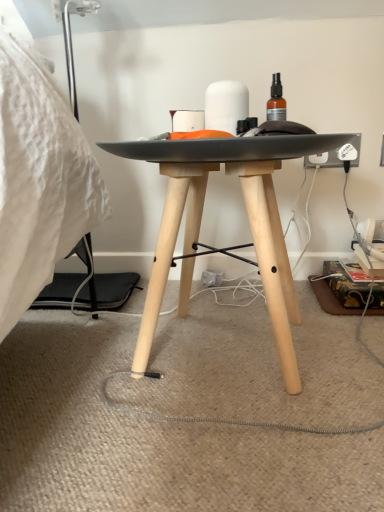
Question: Is black cord at lower center wider than white matte cylinder at center?

Choices:
 (A) yes
 (B) no

Answer: (A)

Question: From the image's perspective, is black cord at lower center beneath white matte cylinder at center?

Choices:
 (A) yes
 (B) no

Answer: (A)

Question: From the image's perspective, is black cord at lower center over white matte cylinder at center?

Choices:
 (A) yes
 (B) no

Answer: (B)

Question: Can you confirm if black cord at lower center is positioned to the right of white matte cylinder at center?

Choices:
 (A) yes
 (B) no

Answer: (B)

Question: Is black cord at lower center positioned far away from white matte cylinder at center?

Choices:
 (A) no
 (B) yes

Answer: (A)

Question: Can we say black cord at lower center lies outside white matte cylinder at center?

Choices:
 (A) no
 (B) yes

Answer: (B)

Question: From a real-world perspective, is white matte cylinder at center on black cord at lower center?

Choices:
 (A) yes
 (B) no

Answer: (A)

Question: Is white matte cylinder at center positioned far away from black cord at lower center?

Choices:
 (A) no
 (B) yes

Answer: (A)

Question: Can you confirm if white matte cylinder at center is positioned to the left of black cord at lower center?

Choices:
 (A) no
 (B) yes

Answer: (A)

Question: Is white matte cylinder at center looking in the opposite direction of black cord at lower center?

Choices:
 (A) no
 (B) yes

Answer: (A)

Question: Is white matte cylinder at center with black cord at lower center?

Choices:
 (A) no
 (B) yes

Answer: (A)

Question: Does white matte cylinder at center have a smaller size compared to black cord at lower center?

Choices:
 (A) no
 (B) yes

Answer: (B)

Question: From the image's perspective, relative to black cord at lower center, is white matte cylinder at center above or below?

Choices:
 (A) below
 (B) above

Answer: (B)